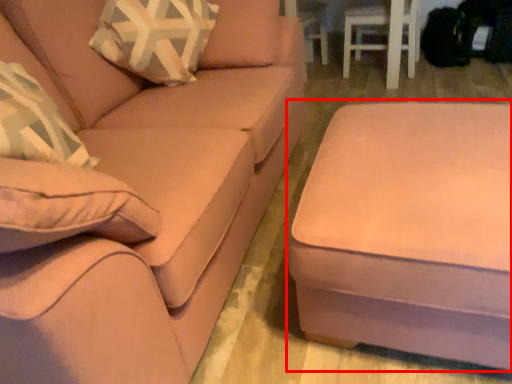
Question: Considering the relative positions of table (annotated by the red box) and studio couch in the image provided, where is table (annotated by the red box) located with respect to the staircase?

Choices:
 (A) right
 (B) left

Answer: (A)